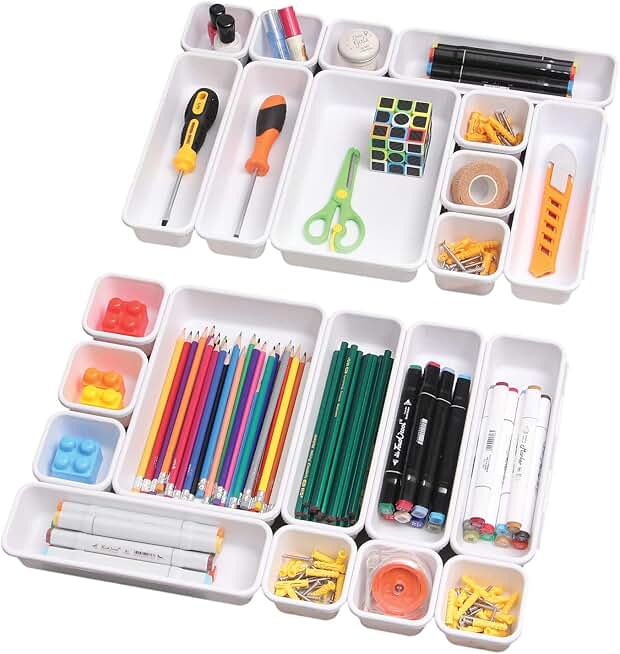
The height and width of the screenshot is (654, 620). In order to click on cubbies with yellow drywall screw in this screenshot , I will do `click(494, 118)`, `click(470, 247)`, `click(479, 606)`, `click(321, 570)`.